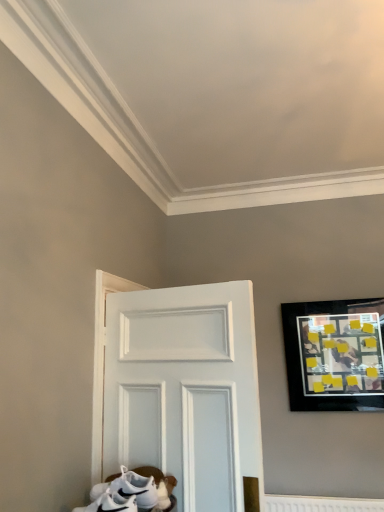
Question: Is white matte sneakers at lower left turned away from black matte picture frame at upper right?

Choices:
 (A) no
 (B) yes

Answer: (A)

Question: Considering the relative positions of white matte sneakers at lower left and black matte picture frame at upper right in the image provided, is white matte sneakers at lower left behind black matte picture frame at upper right?

Choices:
 (A) yes
 (B) no

Answer: (B)

Question: Considering the relative positions of white matte sneakers at lower left and black matte picture frame at upper right in the image provided, is white matte sneakers at lower left in front of black matte picture frame at upper right?

Choices:
 (A) yes
 (B) no

Answer: (A)

Question: Can you confirm if white matte sneakers at lower left is wider than black matte picture frame at upper right?

Choices:
 (A) no
 (B) yes

Answer: (B)

Question: Can you confirm if white matte sneakers at lower left is taller than black matte picture frame at upper right?

Choices:
 (A) no
 (B) yes

Answer: (A)

Question: Can you confirm if white matte sneakers at lower left is shorter than black matte picture frame at upper right?

Choices:
 (A) yes
 (B) no

Answer: (A)

Question: Can you confirm if black matte picture frame at upper right is taller than white matte sneakers at lower left?

Choices:
 (A) no
 (B) yes

Answer: (B)

Question: Is white matte sneakers at lower left surrounded by black matte picture frame at upper right?

Choices:
 (A) yes
 (B) no

Answer: (B)

Question: Does black matte picture frame at upper right come behind white matte sneakers at lower left?

Choices:
 (A) yes
 (B) no

Answer: (A)

Question: From the image's perspective, is black matte picture frame at upper right beneath white matte sneakers at lower left?

Choices:
 (A) yes
 (B) no

Answer: (B)

Question: From the image's perspective, is black matte picture frame at upper right on top of white matte sneakers at lower left?

Choices:
 (A) yes
 (B) no

Answer: (A)

Question: Does black matte picture frame at upper right appear on the right side of white matte sneakers at lower left?

Choices:
 (A) no
 (B) yes

Answer: (B)

Question: Is white matte sneakers at lower left inside or outside of black matte picture frame at upper right?

Choices:
 (A) outside
 (B) inside

Answer: (A)